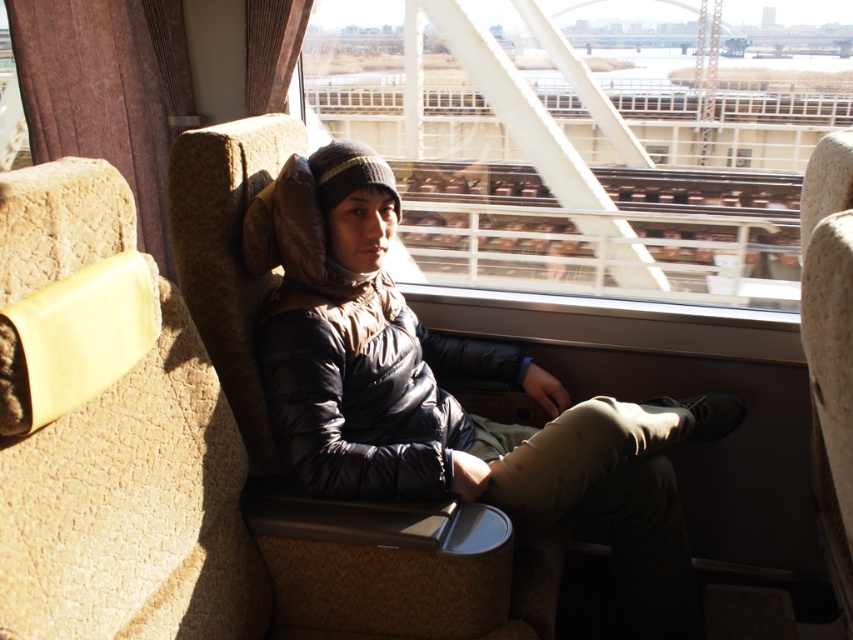
Question: Does transparent glass train window at center appear over matte black jacket at center?

Choices:
 (A) yes
 (B) no

Answer: (A)

Question: Which point is closer to the camera taking this photo?

Choices:
 (A) [697, 237]
 (B) [347, 234]

Answer: (B)

Question: Observing the image, what is the correct spatial positioning of transparent glass train window at center in reference to matte black jacket at center?

Choices:
 (A) below
 (B) above

Answer: (B)

Question: Which object appears farthest from the camera in this image?

Choices:
 (A) transparent glass train window at center
 (B) matte black jacket at center

Answer: (A)

Question: Observing the image, what is the correct spatial positioning of transparent glass train window at center in reference to matte black jacket at center?

Choices:
 (A) above
 (B) below

Answer: (A)